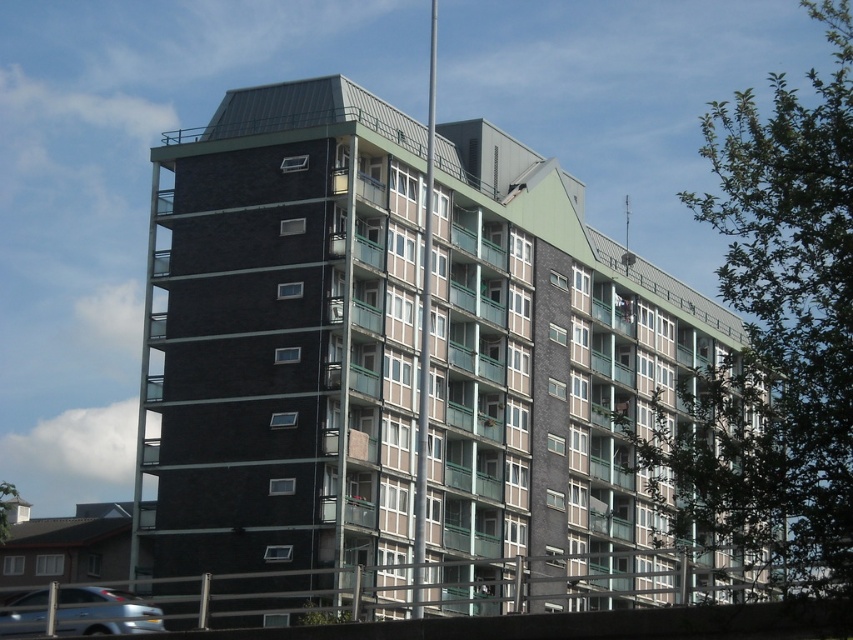
Is dark gray concrete building at center in front of silver metallic car at lower left?

That is True.

Based on the photo, who is more forward, [155,147] or [74,614]?

Positioned in front is point [74,614].

In order to click on dark gray concrete building at center in this screenshot , I will do `click(399, 369)`.

Does dark gray concrete building at center have a lesser height compared to green leafy tree at upper right?

Yes.

Is point (154, 212) positioned before point (821, 356)?

No, it is behind (821, 356).

Does point (216, 458) come in front of point (811, 285)?

No, it is behind (811, 285).

Identify the location of dark gray concrete building at center. This screenshot has width=853, height=640. (399, 369).

Who is positioned more to the right, green leafy tree at upper right or silver metallic car at lower left?

green leafy tree at upper right

In the scene shown: Does green leafy tree at upper right lie in front of silver metallic car at lower left?

Yes.

Identify the location of green leafy tree at upper right. The height and width of the screenshot is (640, 853). (775, 339).